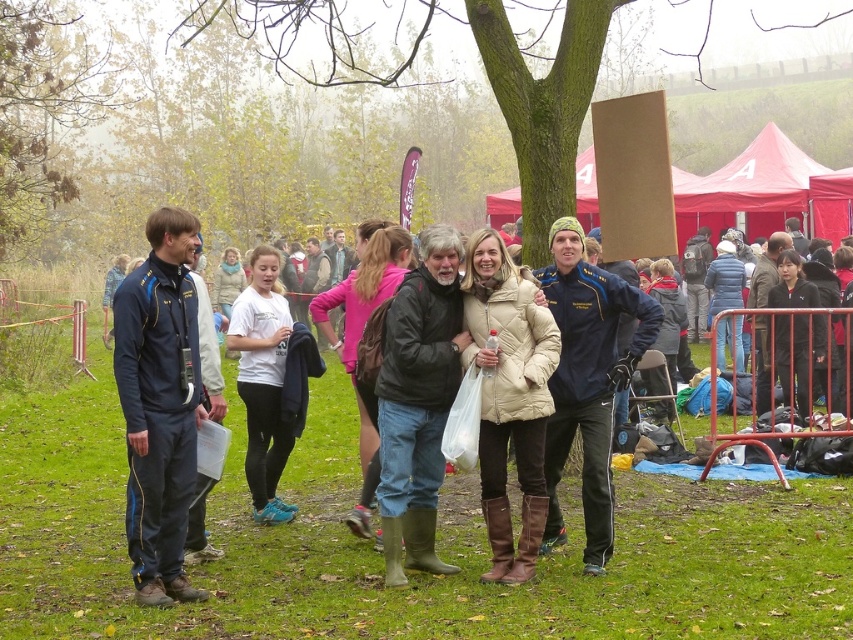
From the picture: You are a photographer trying to capture a photo of the beige quilted coat at center and the cardboard sign at center. Which object will appear taller in the photo?

The cardboard sign at center is taller than the beige quilted coat at center, so it will appear taller in the photo.

You are a photographer at the event and want to capture a photo of the beige quilted coat at center and the cardboard sign at center. Which object should you focus on first if you want to include both in your frame without moving the camera?

The beige quilted coat at center is to the left of the cardboard sign at center, so you should focus on the beige quilted coat at center first to ensure both are in frame without moving the camera.